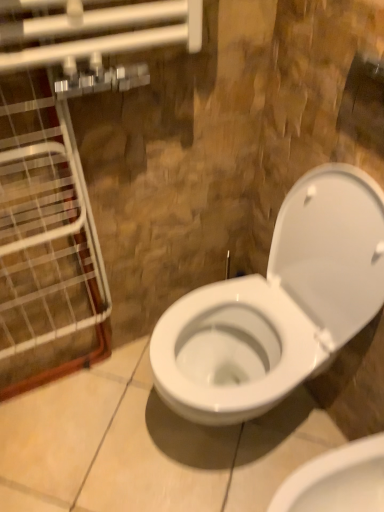
This screenshot has width=384, height=512. Identify the location of spots to the right of clear glass door at left. (124, 402).